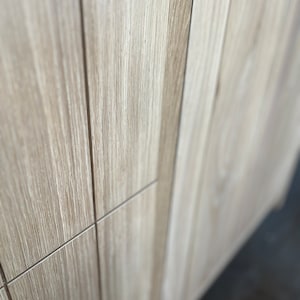
At what (x,y) coordinates should I click in order to perform the action: click on dark wood grain. Please return your answer as a coordinate pair (x, y). The image size is (300, 300). Looking at the image, I should click on [x=69, y=130], [x=72, y=209].